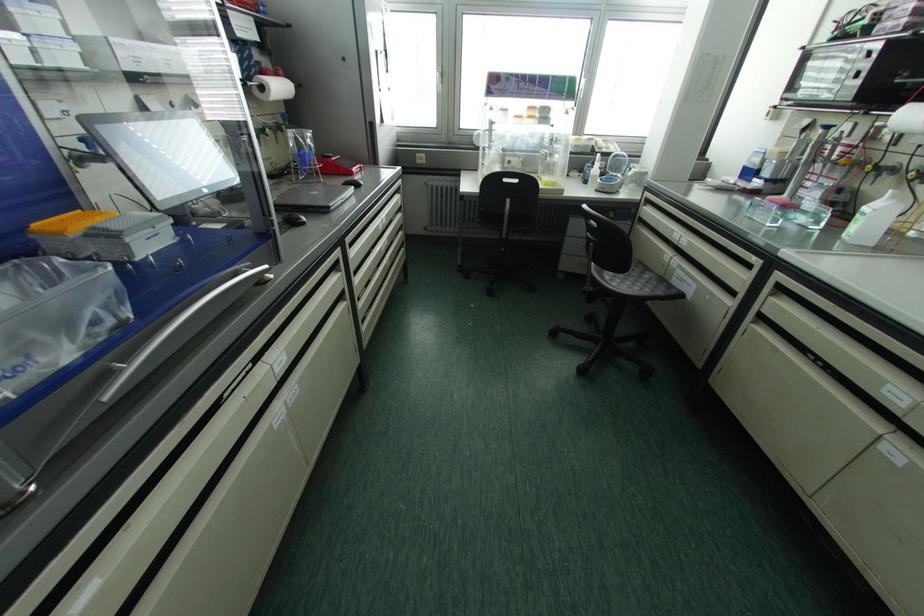
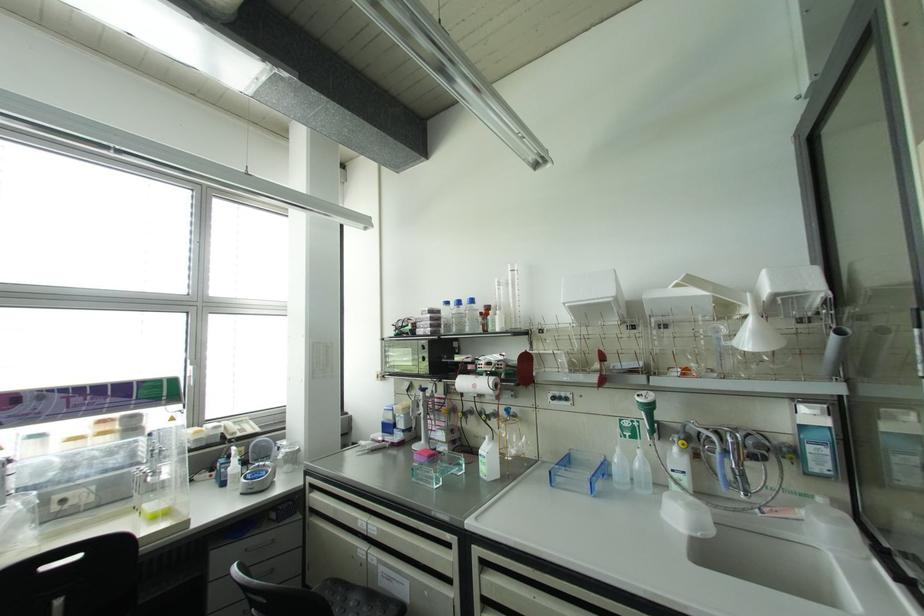
Locate, in the second image, the point that corresponds to point (779, 286) in the first image.

(482, 562)